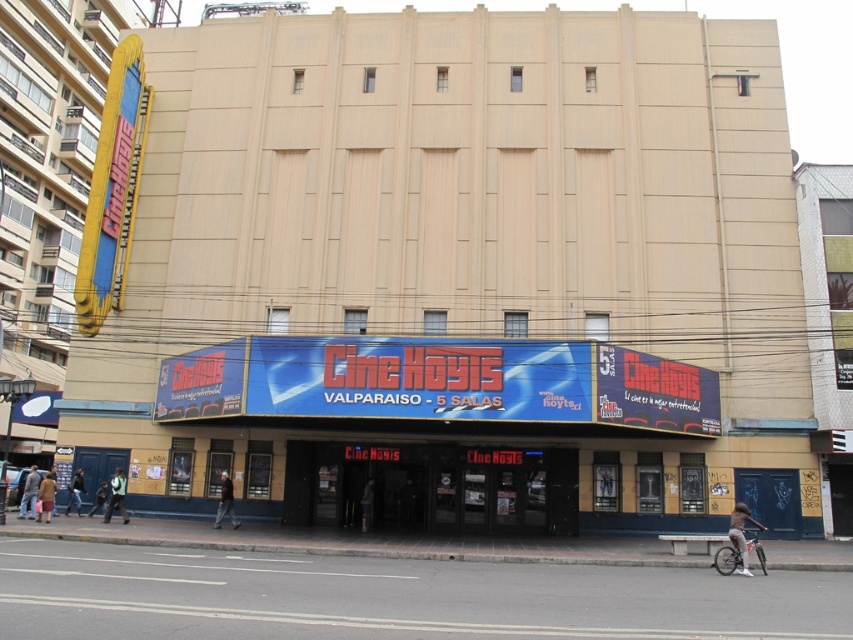
You are standing at the entrance of Cine Hoyts in Valparaiso and want to take a photo of the cinema sign. There are two points marked on your viewfinder at coordinates point (741, 540) and point (74, 488). Which point should you focus on to ensure the cinema sign is in sharp focus?

You should focus on point (741, 540) because it is closer to the camera than point (74, 488), ensuring the cinema sign will be in sharp focus.